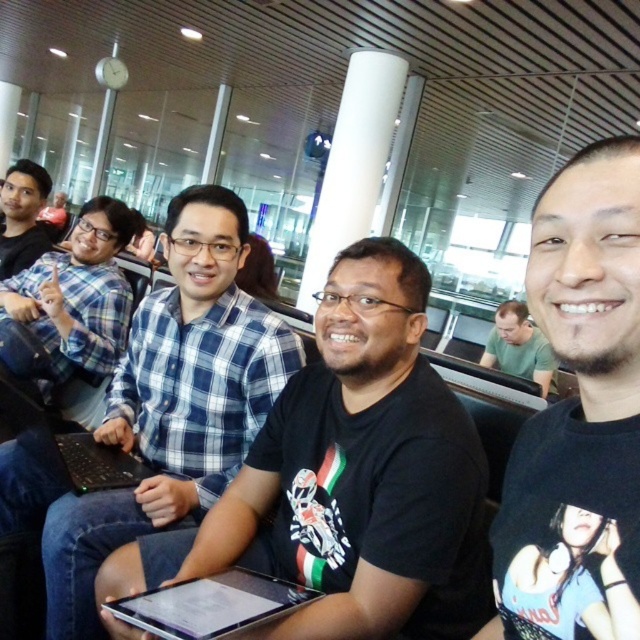
Question: Is black matte shirt at center further to camera compared to blue plaid shirt at left?

Choices:
 (A) yes
 (B) no

Answer: (B)

Question: Based on their relative distances, which object is farther from the blue plaid shirt at left?

Choices:
 (A) green t-shirt at center
 (B) black matte laptop at center
 (C) silver metallic tablet at center
 (D) black matte shirt at center

Answer: (A)

Question: Which point is farther to the camera?

Choices:
 (A) matte black shirt at left
 (B) silver metallic tablet at center
 (C) green t-shirt at center
 (D) black matte laptop at center

Answer: (C)

Question: Which object appears closest to the camera in this image?

Choices:
 (A) black matte laptop at center
 (B) blue plaid shirt at center
 (C) green t-shirt at center

Answer: (B)

Question: Can you confirm if blue plaid shirt at center is positioned to the left of matte black shirt at left?

Choices:
 (A) no
 (B) yes

Answer: (A)

Question: Does black matte t-shirt at center appear under black matte laptop at center?

Choices:
 (A) no
 (B) yes

Answer: (A)